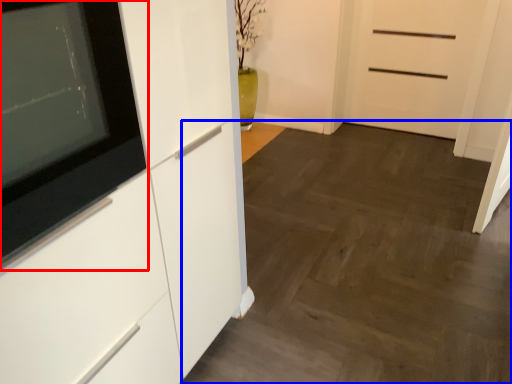
Question: Among these objects, which one is nearest to the camera, appliance (highlighted by a red box) or plain (highlighted by a blue box)?

Choices:
 (A) appliance
 (B) plain

Answer: (A)